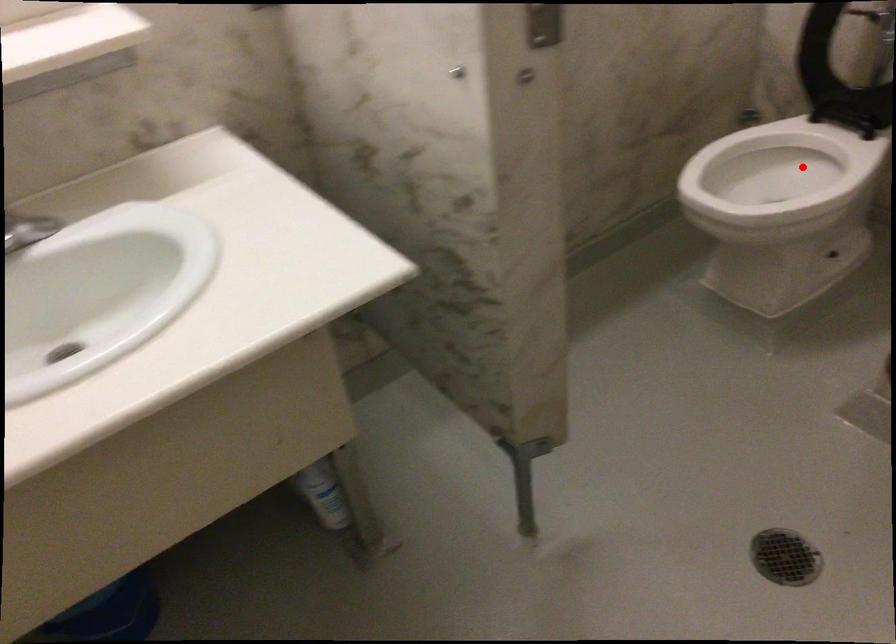
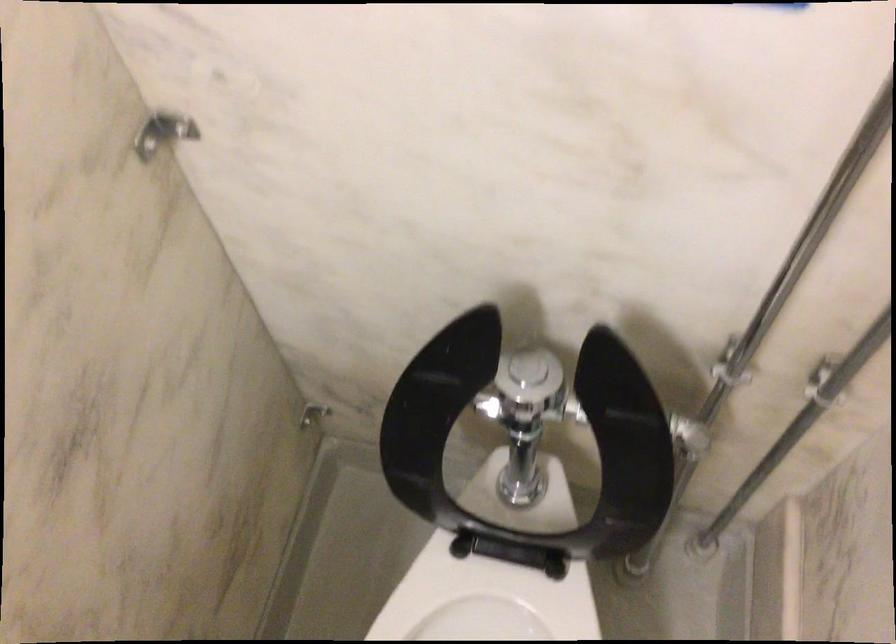
Find the pixel in the second image that matches the highlighted location in the first image.

(487, 605)